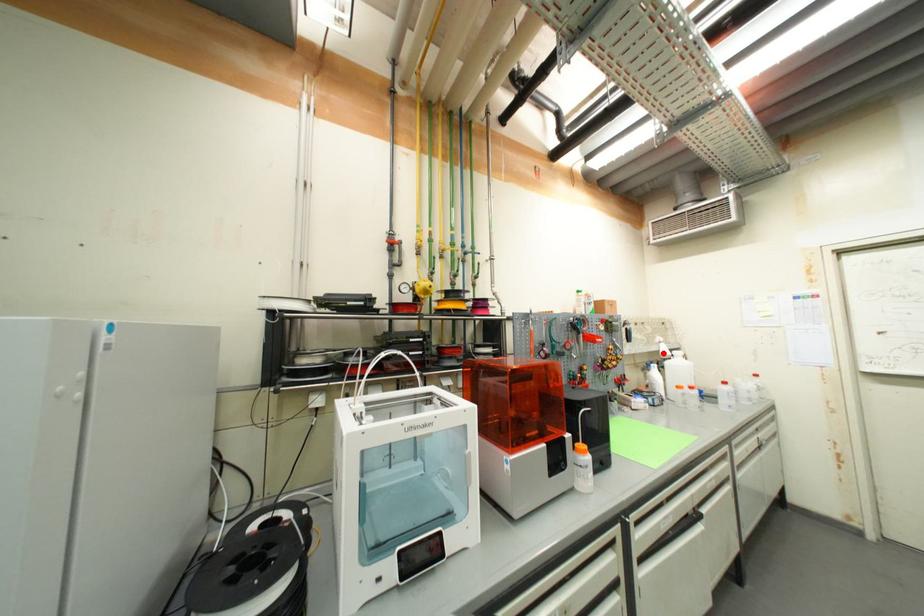
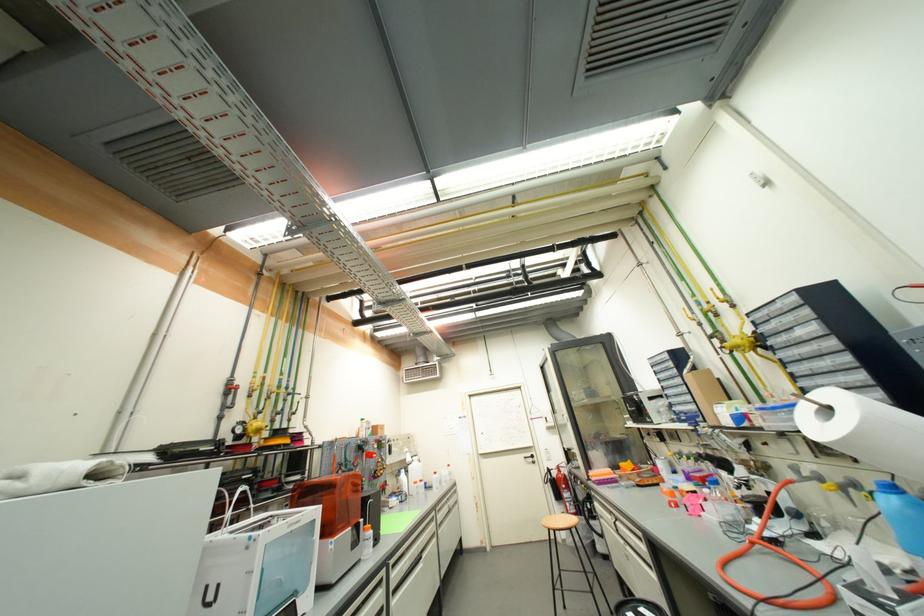
Find the pixel in the second image that matches the highlighted location in the first image.

(410, 461)